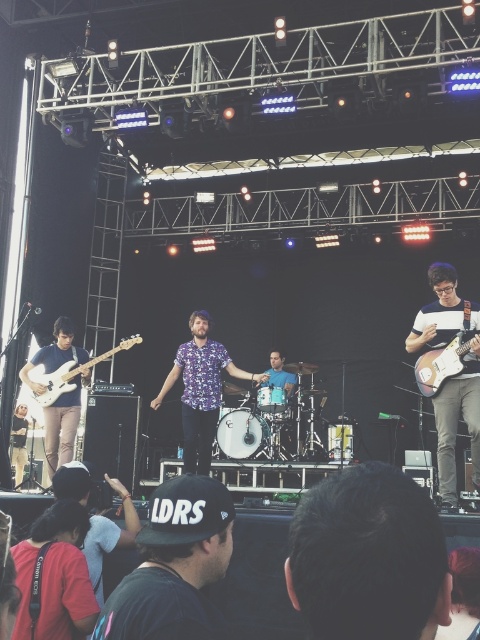
Question: Estimate the real-world distances between objects in this image. Which object is closer to the floral shirt at center?

Choices:
 (A) wooden electric guitar at center
 (B) matte brown electric guitar at right

Answer: (A)

Question: Estimate the real-world distances between objects in this image. Which object is farther from the dark blue shirt at lower left?

Choices:
 (A) black fabric cap at lower center
 (B) floral shirt at center
 (C) matte white electric guitar at left
 (D) matte brown electric guitar at right

Answer: (C)

Question: Does dark brown hair at center come behind floral shirt at center?

Choices:
 (A) no
 (B) yes

Answer: (A)

Question: Where is floral shirt at center located in relation to matte brown electric guitar at right in the image?

Choices:
 (A) left
 (B) right

Answer: (A)

Question: Among these objects, which one is nearest to the camera?

Choices:
 (A) floral shirt at center
 (B) dark brown hair at center

Answer: (B)

Question: Observing the image, what is the correct spatial positioning of wooden electric guitar at center in reference to floral shirt at center?

Choices:
 (A) left
 (B) right

Answer: (B)